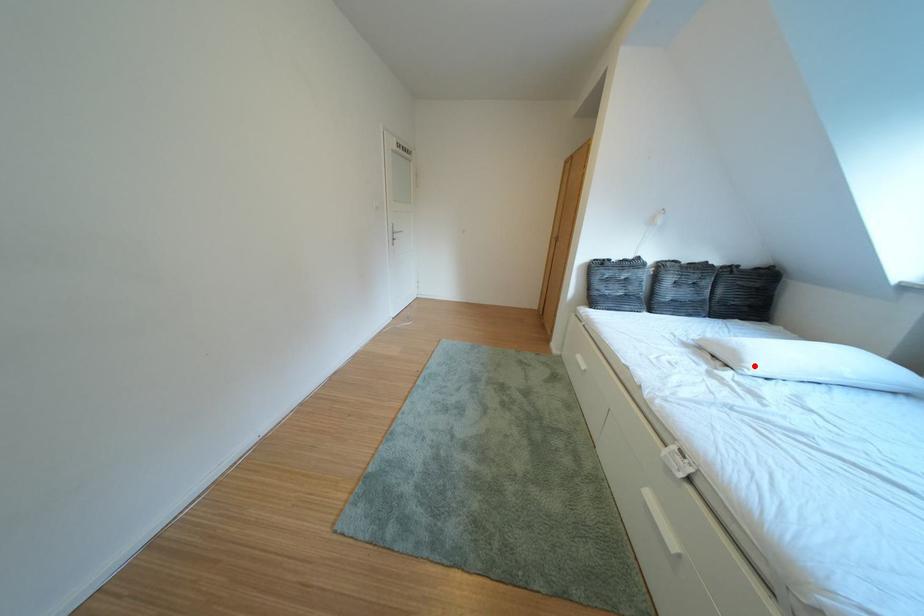
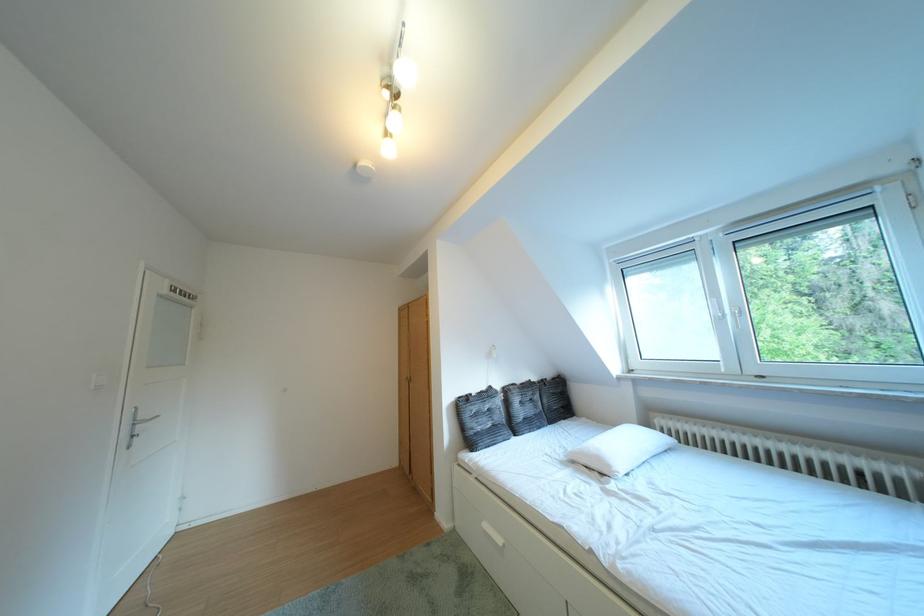
Find the pixel in the second image that matches the highlighted location in the first image.

(623, 471)